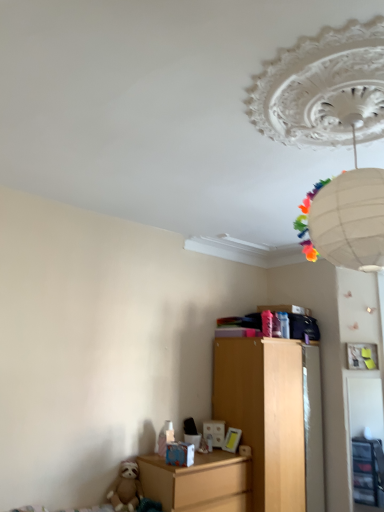
What is the approximate width of matte wooden nightstand at lower left?

matte wooden nightstand at lower left is 20.65 inches in width.

Where is `white paper lantern at upper center`? white paper lantern at upper center is located at coordinates (323, 89).

Describe the element at coordinates (269, 415) in the screenshot. The image size is (384, 512). I see `wooden chest of drawers at center` at that location.

Identify the location of matte wooden nightstand at lower left. The image size is (384, 512). (198, 482).

Which point is more distant from viewer, (170, 477) or (226, 393)?

The point (226, 393) is more distant.

Considering the positions of objects matte wooden nightstand at lower left and wooden chest of drawers at center in the image provided, who is more to the left, matte wooden nightstand at lower left or wooden chest of drawers at center?

matte wooden nightstand at lower left.

Which of these two, matte wooden nightstand at lower left or wooden chest of drawers at center, is smaller?

matte wooden nightstand at lower left is smaller.

Is matte wooden nightstand at lower left turned away from wooden chest of drawers at center?

That's not correct — matte wooden nightstand at lower left is not looking away from wooden chest of drawers at center.

Between brown plush sloth at lower left and white paper lantern at upper center, which one is positioned in front?

white paper lantern at upper center is more forward.

From the image's perspective, which is above, brown plush sloth at lower left or white paper lantern at upper center?

white paper lantern at upper center appears higher in the image.

Considering the sizes of objects brown plush sloth at lower left and white paper lantern at upper center in the image provided, who is taller, brown plush sloth at lower left or white paper lantern at upper center?

white paper lantern at upper center.

Is the surface of wooden chest of drawers at center in direct contact with matte wooden nightstand at lower left?

wooden chest of drawers at center is not next to matte wooden nightstand at lower left, and they're not touching.

Is wooden chest of drawers at center looking in the opposite direction of matte wooden nightstand at lower left?

No, wooden chest of drawers at center is not facing the opposite direction of matte wooden nightstand at lower left.

Considering the sizes of objects wooden chest of drawers at center and matte wooden nightstand at lower left in the image provided, who is thinner, wooden chest of drawers at center or matte wooden nightstand at lower left?

With smaller width is matte wooden nightstand at lower left.

Consider the image. From the image's perspective, is wooden chest of drawers at center on top of matte wooden nightstand at lower left?

Correct, wooden chest of drawers at center appears higher than matte wooden nightstand at lower left in the image.

From a real-world perspective, is white paper lantern at upper center below wooden chest of drawers at center?

No, from a real-world perspective, white paper lantern at upper center is not below wooden chest of drawers at center.

Consider the image. Is white paper lantern at upper center far from wooden chest of drawers at center?

Yes.

Is white paper lantern at upper center turned away from wooden chest of drawers at center?

white paper lantern at upper center does not have its back to wooden chest of drawers at center.

Is wooden chest of drawers at center not near white paper lantern at upper center?

Yes, wooden chest of drawers at center and white paper lantern at upper center are located far from each other.

In the scene shown: Is wooden chest of drawers at center to the left of white paper lantern at upper center from the viewer's perspective?

In fact, wooden chest of drawers at center is to the right of white paper lantern at upper center.

Measure the distance from wooden chest of drawers at center to white paper lantern at upper center.

A distance of 7.78 feet exists between wooden chest of drawers at center and white paper lantern at upper center.

Which is in front, point (319, 469) or point (315, 85)?

The point (315, 85) is closer to the camera.

Between brown plush sloth at lower left and wooden chest of drawers at center, which one has smaller width?

brown plush sloth at lower left.

From a real-world perspective, is brown plush sloth at lower left physically above wooden chest of drawers at center?

No.

Considering the sizes of objects brown plush sloth at lower left and wooden chest of drawers at center in the image provided, who is taller, brown plush sloth at lower left or wooden chest of drawers at center?

wooden chest of drawers at center.

Is point (250, 504) farther from camera compared to point (376, 42)?

Yes, point (250, 504) is behind point (376, 42).

Considering their positions, is matte wooden nightstand at lower left located in front of or behind white paper lantern at upper center?

matte wooden nightstand at lower left is positioned farther from the viewer than white paper lantern at upper center.

Does matte wooden nightstand at lower left touch white paper lantern at upper center?

No, matte wooden nightstand at lower left is not in contact with white paper lantern at upper center.

From a real-world perspective, is matte wooden nightstand at lower left beneath white paper lantern at upper center?

Yes, from a real-world perspective, matte wooden nightstand at lower left is below white paper lantern at upper center.

This screenshot has height=512, width=384. What are the coordinates of `chest of drawers that appears on the right of matte wooden nightstand at lower left` in the screenshot? It's located at (269, 415).

Find the location of a particular element. The width and height of the screenshot is (384, 512). toy below the white paper lantern at upper center (from a real-world perspective) is located at coordinates click(126, 488).

Which object lies further to the anchor point wooden chest of drawers at center, white paper lantern at upper center or brown plush sloth at lower left?

Based on the image, white paper lantern at upper center appears to be further to wooden chest of drawers at center.

When comparing their distances from matte wooden nightstand at lower left, does white paper lantern at upper center or brown plush sloth at lower left seem closer?

Among the two, brown plush sloth at lower left is located nearer to matte wooden nightstand at lower left.

Considering their positions, is white paper lantern at upper center positioned closer to brown plush sloth at lower left than matte wooden nightstand at lower left?

The object closer to brown plush sloth at lower left is matte wooden nightstand at lower left.

Considering their positions, is white paper lantern at upper center positioned further to matte wooden nightstand at lower left than wooden chest of drawers at center?

white paper lantern at upper center is positioned further to the anchor matte wooden nightstand at lower left.

Based on their spatial positions, is matte wooden nightstand at lower left or brown plush sloth at lower left closer to wooden chest of drawers at center?

matte wooden nightstand at lower left lies closer to wooden chest of drawers at center than the other object.

Considering their positions, is wooden chest of drawers at center positioned further to white paper lantern at upper center than brown plush sloth at lower left?

Based on the image, brown plush sloth at lower left appears to be further to white paper lantern at upper center.

When comparing their distances from brown plush sloth at lower left, does wooden chest of drawers at center or white paper lantern at upper center seem further?

white paper lantern at upper center.

Estimate the real-world distances between objects in this image. Which object is further from brown plush sloth at lower left, white paper lantern at upper center or wooden chest of drawers at center?

white paper lantern at upper center lies further to brown plush sloth at lower left than the other object.

The width and height of the screenshot is (384, 512). I want to click on nightstand between brown plush sloth at lower left and wooden chest of drawers at center from left to right, so click(x=198, y=482).

Identify the location of toy located between white paper lantern at upper center and wooden chest of drawers at center in the depth direction. The height and width of the screenshot is (512, 384). (126, 488).

Where is `toy between white paper lantern at upper center and matte wooden nightstand at lower left from top to bottom`? The image size is (384, 512). toy between white paper lantern at upper center and matte wooden nightstand at lower left from top to bottom is located at coordinates (126, 488).

At what (x,y) coordinates should I click in order to perform the action: click on the chest of drawers between white paper lantern at upper center and matte wooden nightstand at lower left vertically. Please return your answer as a coordinate pair (x, y). The width and height of the screenshot is (384, 512). Looking at the image, I should click on (269, 415).